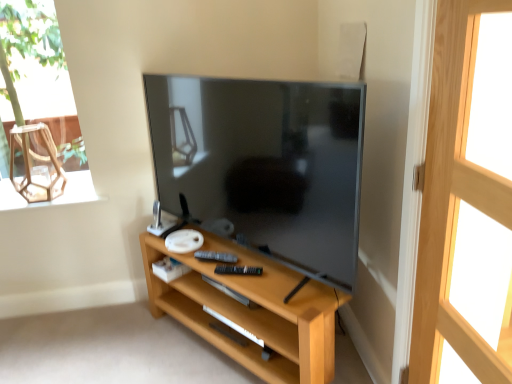
Consider the image. What is the approximate height of light wood shelf at center?

light wood shelf at center is 49.00 centimeters in height.

Where is `light wood shelf at center`? The image size is (512, 384). light wood shelf at center is located at coordinates (251, 311).

Image resolution: width=512 pixels, height=384 pixels. In order to click on transparent glass armchair at upper left in this screenshot , I will do pos(36,161).

You are a GUI agent. You are given a task and a screenshot of the screen. Output one action in this format:
    pyautogui.click(x=<x>, y=<y>)
    Task: Click on the clear glass window at upper left
    This screenshot has height=384, width=512.
    Given the screenshot: What is the action you would take?
    pyautogui.click(x=42, y=99)

What is the approximate width of matte black tv at center?

It is 9.08 inches.

At what (x,y) coordinates should I click in order to perform the action: click on clear glass window sill at left. Please return your answer as a coordinate pair (x, y). Looking at the image, I should click on (55, 198).

From a real-world perspective, who is located higher, clear glass window sill at left or matte black tv at center?

matte black tv at center, from a real-world perspective.

Can you tell me how much clear glass window sill at left and matte black tv at center differ in facing direction?

They differ by 53.5 degrees in their facing directions.

Can you confirm if clear glass window sill at left is bigger than matte black tv at center?

No.

Which object is positioned more to the right, black plastic remote at center or light wood shelf at center?

light wood shelf at center.

From the image's perspective, between black plastic remote at center and light wood shelf at center, which one is located above?

black plastic remote at center appears higher in the image.

Considering the sizes of black plastic remote at center and light wood shelf at center in the image, is black plastic remote at center taller or shorter than light wood shelf at center?

In the image, black plastic remote at center appears to be shorter than light wood shelf at center.

From the picture: How far apart are black plastic remote at center and light wood shelf at center?

The distance of black plastic remote at center from light wood shelf at center is 12.36 inches.

Looking at this image, from a real-world perspective, is clear glass window at upper left located beneath transparent glass armchair at upper left?

No, from a real-world perspective, clear glass window at upper left is not below transparent glass armchair at upper left.

From the picture: In terms of height, does clear glass window at upper left look taller or shorter compared to transparent glass armchair at upper left?

clear glass window at upper left is taller than transparent glass armchair at upper left.

Does clear glass window at upper left have a smaller size compared to transparent glass armchair at upper left?

No.

How distant is clear glass window at upper left from transparent glass armchair at upper left?

clear glass window at upper left is 44.96 centimeters from transparent glass armchair at upper left.

Is clear glass window sill at left situated inside light wood shelf at center or outside?

clear glass window sill at left is located beyond the bounds of light wood shelf at center.

Is clear glass window sill at left oriented towards light wood shelf at center?

No, clear glass window sill at left is not turned towards light wood shelf at center.

Based on the photo, is clear glass window sill at left bigger or smaller than light wood shelf at center?

Clearly, clear glass window sill at left is smaller in size than light wood shelf at center.

From a real-world perspective, which object stands above the other?

From a 3D spatial view, clear glass window sill at left is above.

Is transparent glass armchair at upper left located within light wood screen door at right?

No, transparent glass armchair at upper left is not a part of light wood screen door at right.

How many degrees apart are the facing directions of light wood screen door at right and transparent glass armchair at upper left?

The angle between the facing direction of light wood screen door at right and the facing direction of transparent glass armchair at upper left is 90.8 degrees.

From a real-world perspective, is light wood screen door at right positioned above or below transparent glass armchair at upper left?

From a real-world perspective, light wood screen door at right is physically below transparent glass armchair at upper left.

At what (x,y) coordinates should I click in order to perform the action: click on screen door that is on the right side of transparent glass armchair at upper left. Please return your answer as a coordinate pair (x, y). Image resolution: width=512 pixels, height=384 pixels. Looking at the image, I should click on (453, 200).

Locate an element on the screen. The height and width of the screenshot is (384, 512). window to the left of light wood shelf at center is located at coordinates (42, 99).

Which is further, (244, 280) or (51, 60)?

The point (51, 60) is farther from the camera.

From a real-world perspective, is light wood shelf at center on top of clear glass window at upper left?

Actually, light wood shelf at center is physically below clear glass window at upper left in the real world.

Is light wood shelf at center inside or outside of clear glass window at upper left?

light wood shelf at center cannot be found inside clear glass window at upper left.

Could you tell me if clear glass window at upper left is turned towards matte black tv at center?

No, clear glass window at upper left does not turn towards matte black tv at center.

Is clear glass window at upper left positioned in front of matte black tv at center?

No, clear glass window at upper left is behind matte black tv at center.

Considering the sizes of objects clear glass window at upper left and matte black tv at center in the image provided, who is thinner, clear glass window at upper left or matte black tv at center?

clear glass window at upper left is thinner.

From a real-world perspective, is clear glass window at upper left positioned above or below matte black tv at center?

Clearly, from a real-world perspective, clear glass window at upper left is above matte black tv at center.

Identify the location of television above the clear glass window sill at left (from the image's perspective). The image size is (512, 384). (264, 164).

You are a GUI agent. You are given a task and a screenshot of the screen. Output one action in this format:
    pyautogui.click(x=<x>, y=<y>)
    Task: Click on the shelf below the black plastic remote at center (from a real-world perspective)
    This screenshot has width=512, height=384.
    Given the screenshot: What is the action you would take?
    pyautogui.click(x=251, y=311)

Looking at the image, which one is located closer to clear glass window at upper left, black plastic remote at center or transparent glass armchair at upper left?

transparent glass armchair at upper left is closer to clear glass window at upper left.

Estimate the real-world distances between objects in this image. Which object is closer to light wood shelf at center, black plastic remote at center or transparent glass armchair at upper left?

black plastic remote at center lies closer to light wood shelf at center than the other object.

When comparing their distances from matte black tv at center, does light wood screen door at right or light wood shelf at center seem closer?

light wood shelf at center.

Based on the photo, based on their spatial positions, is matte black tv at center or transparent glass armchair at upper left closer to clear glass window sill at left?

Among the two, transparent glass armchair at upper left is located nearer to clear glass window sill at left.

Estimate the real-world distances between objects in this image. Which object is closer to light wood screen door at right, matte black tv at center or transparent glass armchair at upper left?

matte black tv at center lies closer to light wood screen door at right than the other object.

When comparing their distances from light wood screen door at right, does transparent glass armchair at upper left or black plastic remote at center seem further?

Among the two, transparent glass armchair at upper left is located further to light wood screen door at right.

Considering their positions, is clear glass window at upper left positioned closer to light wood shelf at center than matte black tv at center?

Based on the image, matte black tv at center appears to be nearer to light wood shelf at center.

Based on their spatial positions, is clear glass window sill at left or transparent glass armchair at upper left further from light wood screen door at right?

transparent glass armchair at upper left lies further to light wood screen door at right than the other object.

Where is `remote between clear glass window at upper left and light wood screen door at right`? The width and height of the screenshot is (512, 384). remote between clear glass window at upper left and light wood screen door at right is located at coordinates (216, 257).

The width and height of the screenshot is (512, 384). I want to click on television between transparent glass armchair at upper left and light wood shelf at center from left to right, so click(264, 164).

Where is `window sill located between clear glass window at upper left and light wood shelf at center in the left-right direction`? This screenshot has height=384, width=512. window sill located between clear glass window at upper left and light wood shelf at center in the left-right direction is located at coordinates (55, 198).

Locate an element on the screen. This screenshot has height=384, width=512. remote situated between clear glass window sill at left and matte black tv at center from left to right is located at coordinates (216, 257).